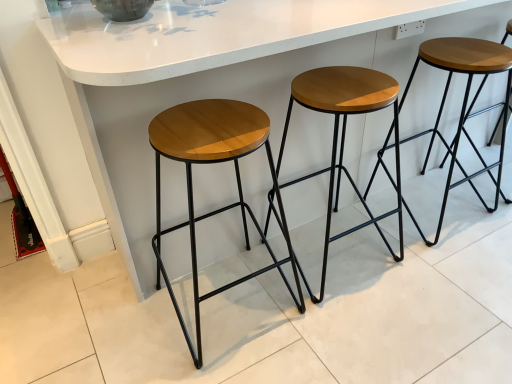
Question: Considering the relative sizes of white glossy counter at center and wooden/matte stool at center, acting as the second stool starting from the right, in the image provided, is white glossy counter at center wider than wooden/matte stool at center, acting as the second stool starting from the right,?

Choices:
 (A) yes
 (B) no

Answer: (A)

Question: Can you confirm if white glossy counter at center is bigger than wooden/matte stool at center, marked as the 2th stool in a left-to-right arrangement?

Choices:
 (A) no
 (B) yes

Answer: (B)

Question: Can you confirm if white glossy counter at center is taller than wooden/matte stool at center, acting as the second stool starting from the right?

Choices:
 (A) no
 (B) yes

Answer: (B)

Question: From a real-world perspective, is white glossy counter at center below wooden/matte stool at center, marked as the 2th stool in a left-to-right arrangement?

Choices:
 (A) no
 (B) yes

Answer: (A)

Question: From the image's perspective, would you say white glossy counter at center is shown under wooden/matte stool at center, marked as the 2th stool in a left-to-right arrangement?

Choices:
 (A) yes
 (B) no

Answer: (B)

Question: Is point tap(178, 153) positioned closer to the camera than point tap(499, 64)?

Choices:
 (A) farther
 (B) closer

Answer: (B)

Question: Looking at the image, does wooden/matte stool at center, the third stool from the right, seem bigger or smaller compared to wooden seat at center, arranged as the 1th stool when viewed from the right?

Choices:
 (A) small
 (B) big

Answer: (A)

Question: Considering their positions, is wooden/matte stool at center, placed as the first stool when sorted from left to right, located in front of or behind wooden seat at center, arranged as the 1th stool when viewed from the right?

Choices:
 (A) behind
 (B) front

Answer: (B)

Question: Looking at their shapes, would you say wooden/matte stool at center, the third stool from the right, is wider or thinner than wooden seat at center, arranged as the 1th stool when viewed from the right?

Choices:
 (A) wide
 (B) thin

Answer: (B)

Question: Considering the positions of white glossy counter at center and wooden/matte stool at center, placed as the first stool when sorted from left to right, in the image, is white glossy counter at center taller or shorter than wooden/matte stool at center, placed as the first stool when sorted from left to right,?

Choices:
 (A) tall
 (B) short

Answer: (A)

Question: From the image's perspective, relative to wooden/matte stool at center, the third stool from the right, is white glossy counter at center above or below?

Choices:
 (A) above
 (B) below

Answer: (A)

Question: Considering the positions of white glossy counter at center and wooden/matte stool at center, placed as the first stool when sorted from left to right, in the image, is white glossy counter at center bigger or smaller than wooden/matte stool at center, placed as the first stool when sorted from left to right,?

Choices:
 (A) big
 (B) small

Answer: (A)

Question: Is white glossy counter at center in front of or behind wooden/matte stool at center, the third stool from the right, in the image?

Choices:
 (A) behind
 (B) front

Answer: (B)

Question: From a real-world perspective, is wooden/matte stool at center, marked as the 2th stool in a left-to-right arrangement, positioned above or below wooden/matte stool at center, the third stool from the right?

Choices:
 (A) below
 (B) above

Answer: (A)

Question: Considering the positions of point (337, 82) and point (286, 284), is point (337, 82) closer or farther from the camera than point (286, 284)?

Choices:
 (A) farther
 (B) closer

Answer: (B)